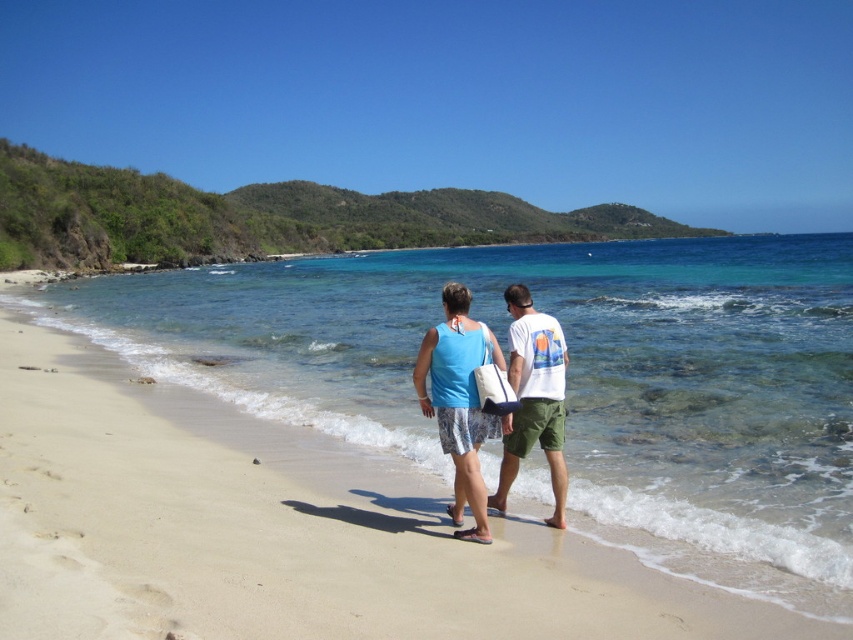
Is clear blue water at center behind matte blue tank top at center?

No, clear blue water at center is closer to the viewer.

Which is behind, point (141, 275) or point (463, 474)?

Point (141, 275)

Is point (711, 282) behind point (459, 497)?

That is True.

What are the coordinates of `clear blue water at center` in the screenshot? It's located at (566, 378).

Describe the element at coordinates (566, 378) in the screenshot. The width and height of the screenshot is (853, 640). I see `clear blue water at center` at that location.

Can you confirm if clear blue water at center is positioned to the right of white cotton t-shirt at center?

Indeed, clear blue water at center is positioned on the right side of white cotton t-shirt at center.

Image resolution: width=853 pixels, height=640 pixels. I want to click on clear blue water at center, so click(x=566, y=378).

I want to click on clear blue water at center, so click(x=566, y=378).

Is matte blue tank top at center to the left of white cotton t-shirt at center from the viewer's perspective?

Yes, matte blue tank top at center is to the left of white cotton t-shirt at center.

What do you see at coordinates (459, 401) in the screenshot? I see `matte blue tank top at center` at bounding box center [459, 401].

You are a GUI agent. You are given a task and a screenshot of the screen. Output one action in this format:
    pyautogui.click(x=<x>, y=<y>)
    Task: Click on the matte blue tank top at center
    This screenshot has width=853, height=640.
    Given the screenshot: What is the action you would take?
    pyautogui.click(x=459, y=401)